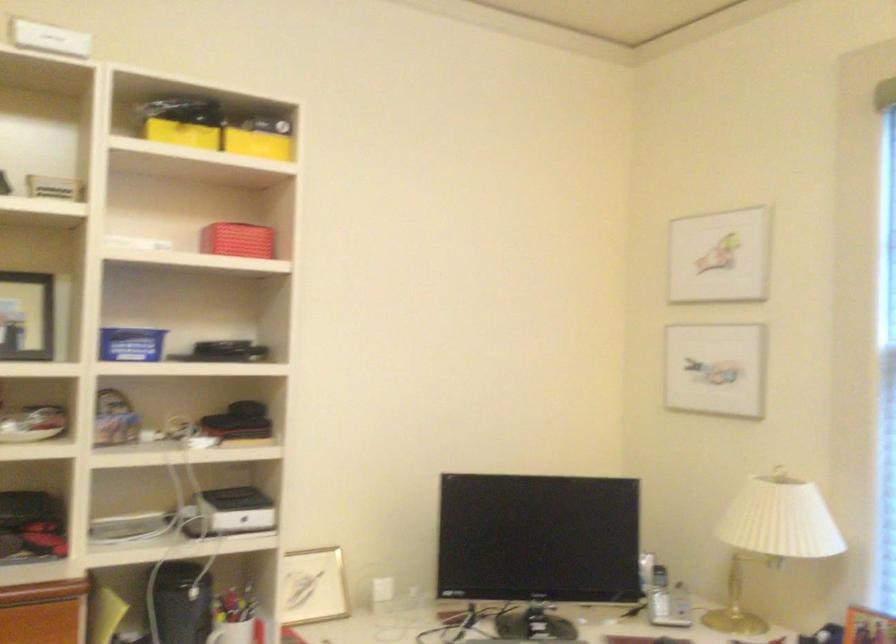
Identify the location of phone handset. (659, 594).